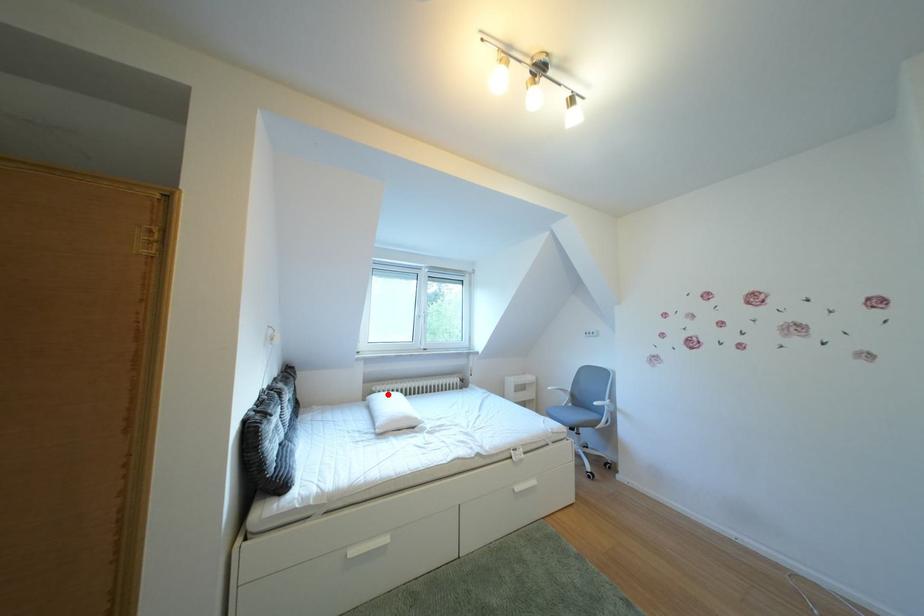
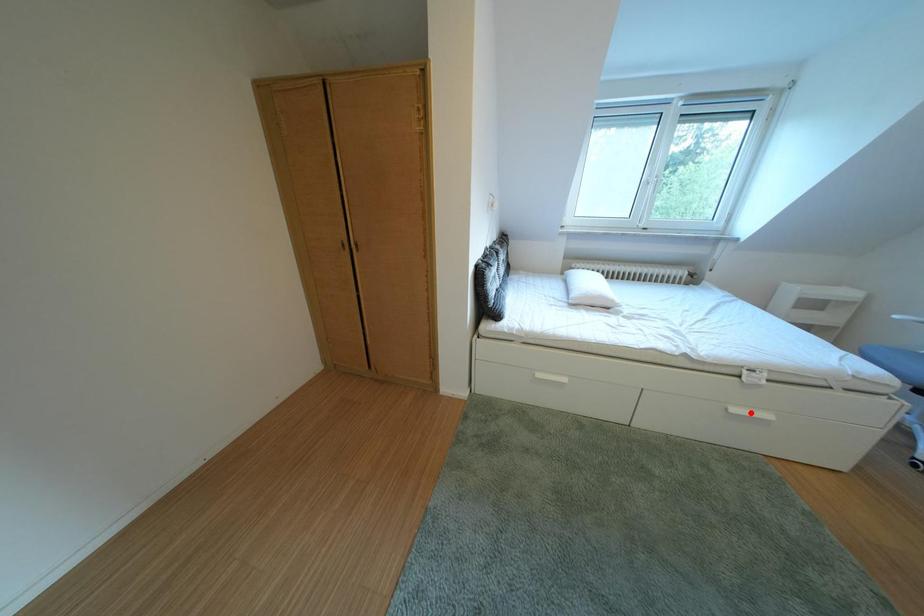
I am providing you with two images of the same scene from different viewpoints. A red point is marked on the first image and another point is marked on the second image. Do the highlighted points in image1 and image2 indicate the same real-world spot?

No